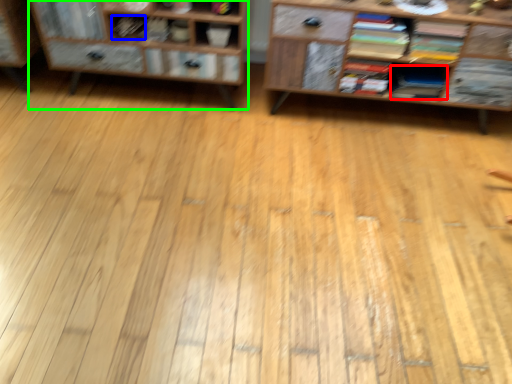
Question: Which object is the farthest from book (highlighted by a red box)? Choose among these: book (highlighted by a blue box) or shelf (highlighted by a green box).

Choices:
 (A) book
 (B) shelf

Answer: (A)